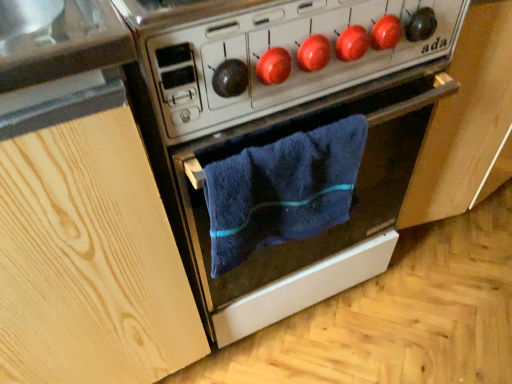
What do you see at coordinates (288, 137) in the screenshot? I see `metallic silver oven at center` at bounding box center [288, 137].

This screenshot has height=384, width=512. What do you see at coordinates (282, 190) in the screenshot?
I see `blue soft towel at center` at bounding box center [282, 190].

Identify the location of light wood cabinet at left. The image size is (512, 384). (82, 210).

The height and width of the screenshot is (384, 512). What do you see at coordinates (82, 210) in the screenshot?
I see `light wood cabinet at left` at bounding box center [82, 210].

Where is `metallic stove at center`? This screenshot has width=512, height=384. metallic stove at center is located at coordinates (276, 52).

Identify the location of appliance that appears above the blue soft towel at center (from a real-world perspective). (276, 52).

Is point (311, 38) closer or farther from the camera than point (277, 152)?

Point (311, 38) is positioned closer to the camera compared to point (277, 152).

Would you say blue soft towel at center is part of metallic stove at center's contents?

Actually, blue soft towel at center is outside metallic stove at center.

Is metallic stove at center positioned with its back to metallic silver oven at center?

No, metallic stove at center is not facing away from metallic silver oven at center.

Considering the relative positions of metallic stove at center and metallic silver oven at center in the image provided, is metallic stove at center to the left or to the right of metallic silver oven at center?

metallic stove at center is positioned on metallic silver oven at center's left side.

Where is `appliance above the metallic silver oven at center (from the image's perspective)`? The width and height of the screenshot is (512, 384). appliance above the metallic silver oven at center (from the image's perspective) is located at coordinates click(x=276, y=52).

Between metallic stove at center and metallic silver oven at center, which one has more height?

With more height is metallic silver oven at center.

Are blue soft towel at center and metallic silver oven at center located far from each other?

Actually, blue soft towel at center and metallic silver oven at center are a little close together.

Is blue soft towel at center taller than metallic silver oven at center?

Incorrect, the height of blue soft towel at center is not larger of that of metallic silver oven at center.

Looking at the image, does blue soft towel at center seem bigger or smaller compared to metallic silver oven at center?

Clearly, blue soft towel at center is smaller in size than metallic silver oven at center.

Measure the distance between blue soft towel at center and metallic silver oven at center.

blue soft towel at center and metallic silver oven at center are 8.04 centimeters apart from each other.

Is metallic silver oven at center turned away from metallic stove at center?

That's not correct — metallic silver oven at center is not looking away from metallic stove at center.

Between metallic silver oven at center and metallic stove at center, which one appears on the right side from the viewer's perspective?

metallic silver oven at center is more to the right.

Is metallic silver oven at center positioned beyond the bounds of metallic stove at center?

metallic silver oven at center is positioned outside metallic stove at center.

Locate an element on the screen. This screenshot has height=384, width=512. cabinetry in front of the blue soft towel at center is located at coordinates (82, 210).

In the scene shown: From a real-world perspective, between light wood cabinet at left and blue soft towel at center, who is vertically higher?

In real-world perspective, blue soft towel at center is above.

From the picture: From a real-world perspective, is light wood cabinet at left located higher than metallic stove at center?

Incorrect, from a real-world perspective, light wood cabinet at left is lower than metallic stove at center.

Is light wood cabinet at left positioned far away from metallic stove at center?

light wood cabinet at left is near metallic stove at center, not far away.

Considering the relative sizes of blue soft towel at center and metallic stove at center in the image provided, is blue soft towel at center bigger than metallic stove at center?

Incorrect, blue soft towel at center is not larger than metallic stove at center.

Is blue soft towel at center turned away from metallic stove at center?

blue soft towel at center is not turned away from metallic stove at center.

Identify the location of appliance above the blue soft towel at center (from a real-world perspective). This screenshot has width=512, height=384. (276, 52).

Is blue soft towel at center far away from metallic stove at center?

They are positioned close to each other.

This screenshot has width=512, height=384. Identify the location of bath towel below the metallic stove at center (from a real-world perspective). (282, 190).

The width and height of the screenshot is (512, 384). Find the location of `appliance that appears in front of the metallic silver oven at center`. appliance that appears in front of the metallic silver oven at center is located at coordinates (276, 52).

Estimate the real-world distances between objects in this image. Which object is further from light wood cabinet at left, metallic stove at center or blue soft towel at center?

metallic stove at center lies further to light wood cabinet at left than the other object.

Estimate the real-world distances between objects in this image. Which object is further from metallic stove at center, metallic silver oven at center or light wood cabinet at left?

light wood cabinet at left is further to metallic stove at center.

Which object lies nearer to the anchor point light wood cabinet at left, metallic stove at center or metallic silver oven at center?

metallic silver oven at center.

Looking at the image, which one is located closer to metallic silver oven at center, metallic stove at center or blue soft towel at center?

blue soft towel at center is closer to metallic silver oven at center.

Consider the image. From the image, which object appears to be farther from light wood cabinet at left, blue soft towel at center or metallic silver oven at center?

blue soft towel at center is further to light wood cabinet at left.

Based on their spatial positions, is metallic stove at center or light wood cabinet at left further from blue soft towel at center?

light wood cabinet at left.

Looking at this image, based on their spatial positions, is light wood cabinet at left or metallic stove at center further from metallic silver oven at center?

The object further to metallic silver oven at center is light wood cabinet at left.

Looking at the image, which one is located further to metallic silver oven at center, light wood cabinet at left or blue soft towel at center?

The object further to metallic silver oven at center is light wood cabinet at left.

Identify the location of appliance between light wood cabinet at left and metallic silver oven at center in the horizontal direction. The image size is (512, 384). (276, 52).

You are a GUI agent. You are given a task and a screenshot of the screen. Output one action in this format:
    pyautogui.click(x=<x>, y=<y>)
    Task: Click on the oven between metallic stove at center and blue soft towel at center from top to bottom
    The width and height of the screenshot is (512, 384).
    Given the screenshot: What is the action you would take?
    pyautogui.click(x=288, y=137)

This screenshot has height=384, width=512. I want to click on appliance between light wood cabinet at left and blue soft towel at center, so (276, 52).

The image size is (512, 384). Find the location of `oven between light wood cabinet at left and blue soft towel at center from left to right`. oven between light wood cabinet at left and blue soft towel at center from left to right is located at coordinates (288, 137).